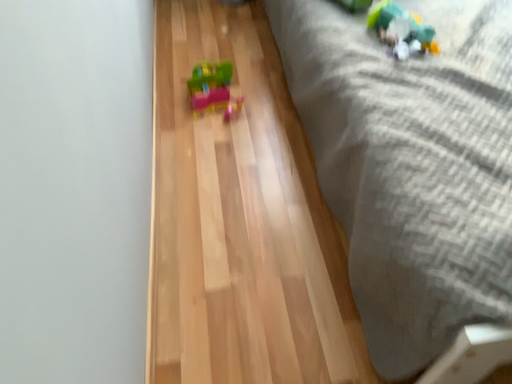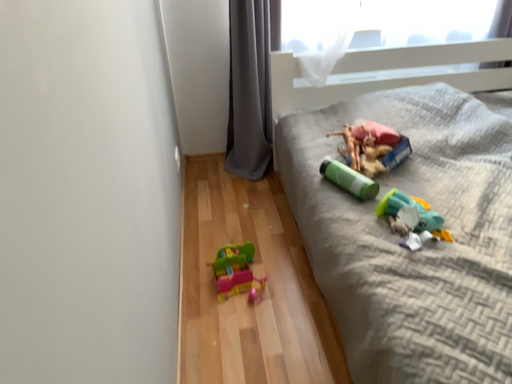
Question: Which way did the camera rotate in the video?

Choices:
 (A) rotated downward
 (B) rotated upward

Answer: (B)